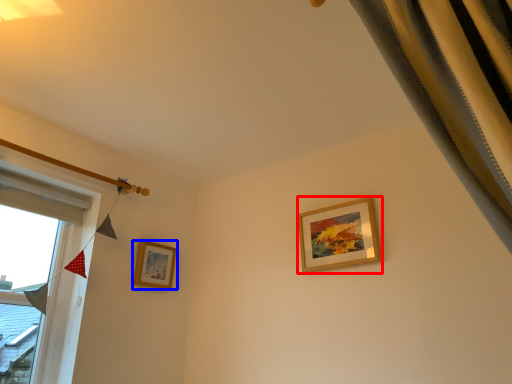
Question: Which point is further to the camera, picture frame (highlighted by a red box) or picture frame (highlighted by a blue box)?

Choices:
 (A) picture frame
 (B) picture frame

Answer: (B)